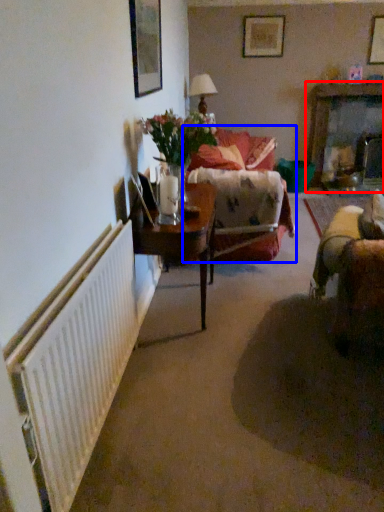
Question: Which object is further to the camera taking this photo, dresser (highlighted by a red box) or studio couch (highlighted by a blue box)?

Choices:
 (A) dresser
 (B) studio couch

Answer: (A)